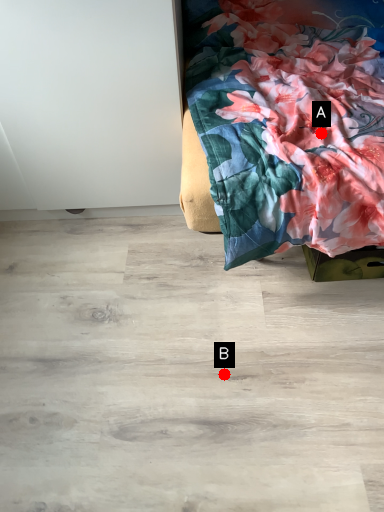
Question: Two points are circled on the image, labeled by A and B beside each circle. Which point is farther to the camera?

Choices:
 (A) A is further
 (B) B is further

Answer: (B)